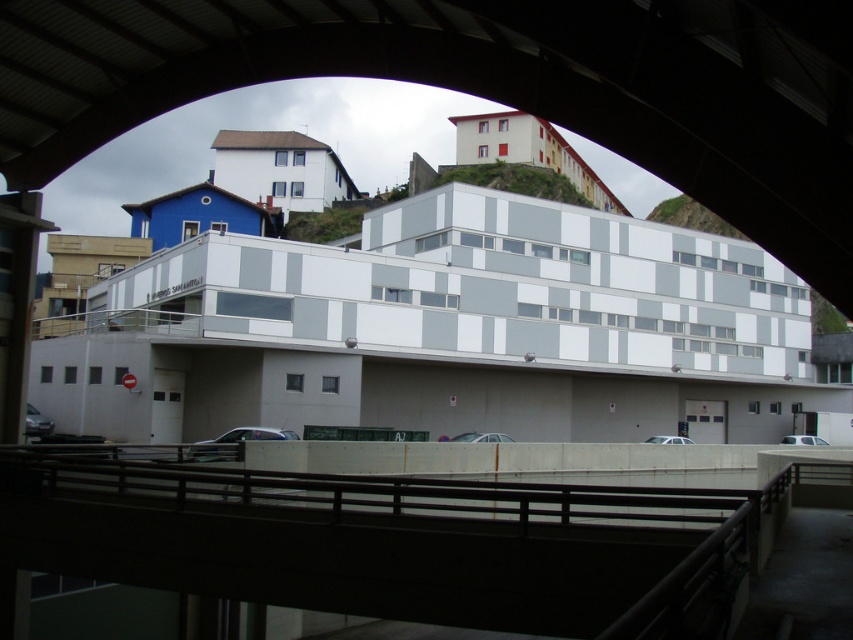
Question: Does white concrete parking garage at center have a larger size compared to black metal rail at center?

Choices:
 (A) yes
 (B) no

Answer: (A)

Question: Which object appears closest to the camera in this image?

Choices:
 (A) white matte building at center
 (B) white concrete parking garage at center

Answer: (A)

Question: Which point is closer to the camera?

Choices:
 (A) black metal rail at center
 (B) white matte building at center

Answer: (A)

Question: Which is nearer to the white concrete parking garage at center?

Choices:
 (A) black metal rail at center
 (B) white matte building at center

Answer: (A)

Question: Does white concrete parking garage at center have a larger size compared to black metal rail at center?

Choices:
 (A) no
 (B) yes

Answer: (B)

Question: Can you confirm if white matte building at center is bigger than black metal rail at center?

Choices:
 (A) no
 (B) yes

Answer: (A)